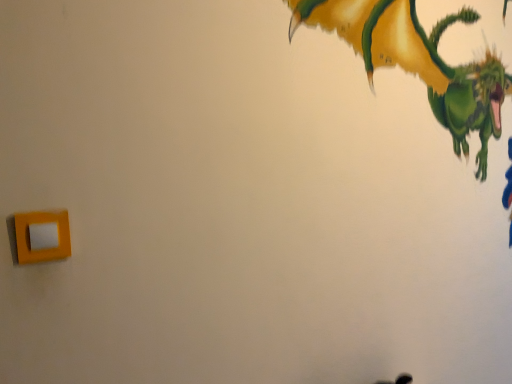
In the scene shown: What is the approximate width of yellow matte switch at lower left?

yellow matte switch at lower left is 1.04 inches wide.

Find the location of a particular element. This screenshot has width=512, height=384. yellow matte switch at lower left is located at coordinates (42, 236).

The height and width of the screenshot is (384, 512). What do you see at coordinates (42, 236) in the screenshot? I see `yellow matte switch at lower left` at bounding box center [42, 236].

Where is `yellow matte switch at lower left`? yellow matte switch at lower left is located at coordinates (42, 236).